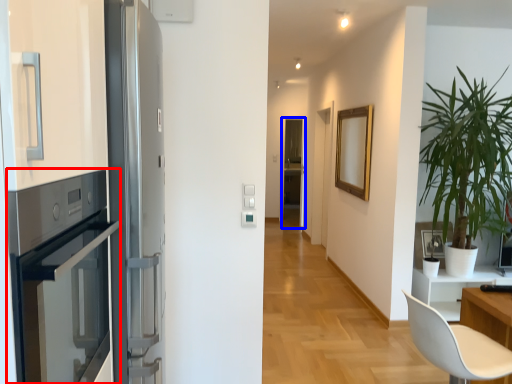
Question: Which point is closer to the camera, oven (highlighted by a red box) or screen door (highlighted by a blue box)?

Choices:
 (A) oven
 (B) screen door

Answer: (A)